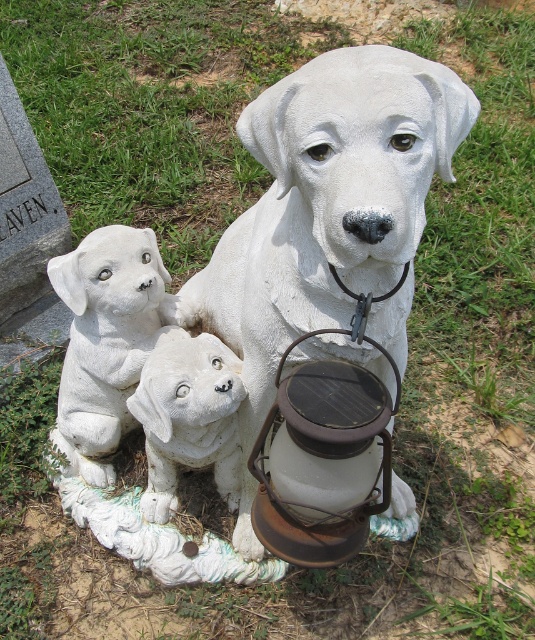
You are an art installer who needs to ensure the stability of the sculpture. Given that the white stone puppies at lower left are heavier than the white matte dog at center, which object should be placed closer to the base to maintain balance?

A: The white stone puppies at lower left should be placed closer to the base because they are heavier and taller than the white matte dog at center, which helps in maintaining balance by lowering the center of gravity.

You are an art installer setting up the sculpture. You need to ensure that the white stone dog at center and the white stone puppies at lower left are visible from the main viewing path. Based on their positions, which one might be more easily seen by visitors approaching from the front?

The white stone dog at center is more easily seen because it is positioned in front of the white stone puppies at lower left, making it closer to the viewing path.

You are a visitor at an outdoor art exhibit and see the sculpture with the rusty metal lantern at center and the white stone puppies at lower left. Which object is located below the other?

The rusty metal lantern at center is positioned under the white stone puppies at lower left, so the lantern is below the puppies.